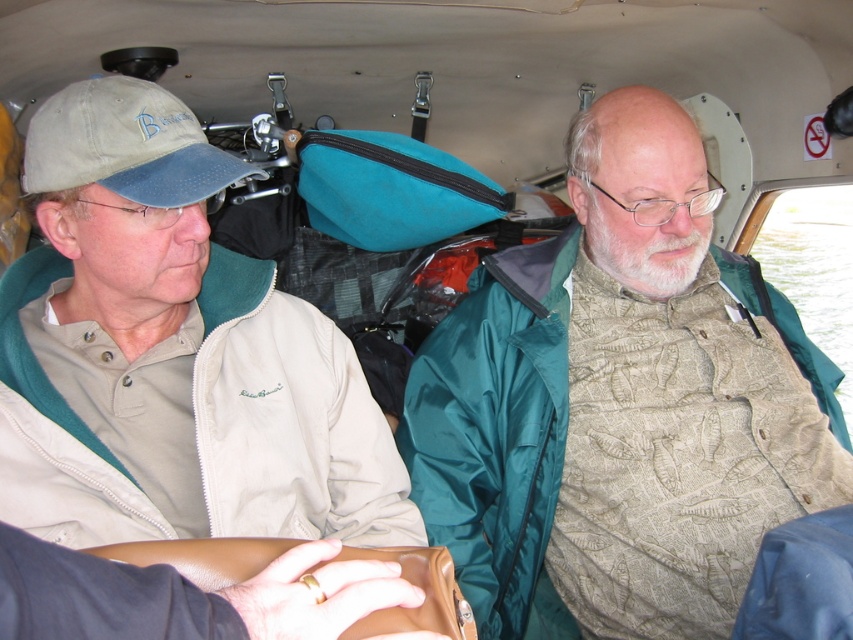
Who is lower down, green textured jacket at center or beige fleece jacket at left?

green textured jacket at center is lower down.

Between point (408, 403) and point (7, 352), which one is positioned in front?

Positioned in front is point (7, 352).

Who is more distant from viewer, (454, 352) or (245, 452)?

Point (454, 352)

Locate an element on the screen. This screenshot has width=853, height=640. green textured jacket at center is located at coordinates (621, 401).

The height and width of the screenshot is (640, 853). Identify the location of green textured jacket at center. (621, 401).

Identify the location of green textured jacket at center. (621, 401).

Find the location of a particular element. green textured jacket at center is located at coordinates (621, 401).

Describe the element at coordinates (171, 353) in the screenshot. The image size is (853, 640). I see `beige fleece jacket at left` at that location.

Is beige fleece jacket at left thinner than khaki fabric baseball cap at left?

No.

Does point (111, 406) come closer to viewer compared to point (47, 113)?

That is False.

What are the coordinates of `beige fleece jacket at left` in the screenshot? It's located at (171, 353).